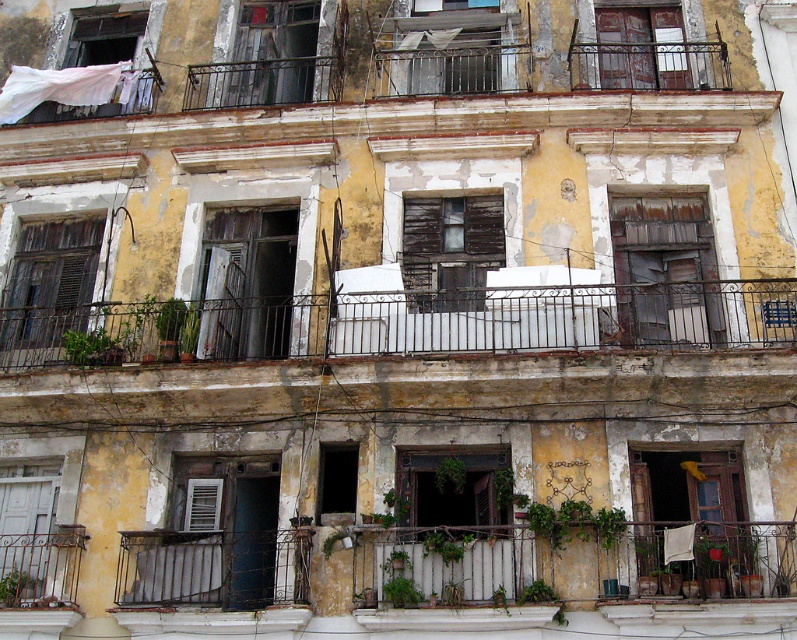
Question: Which object is closer to the camera taking this photo?

Choices:
 (A) wooden door at lower left
 (B) matte white cloth at upper left
 (C) wooden shuttered window at left

Answer: (A)

Question: Can you confirm if wooden shuttered window at left is positioned to the left of matte glass window at upper center?

Choices:
 (A) yes
 (B) no

Answer: (A)

Question: Which point is closer to the camera?

Choices:
 (A) (658, 323)
 (B) (448, 288)
 (C) (240, 228)
 (D) (664, 56)

Answer: (A)

Question: Which object is farther from the camera taking this photo?

Choices:
 (A) rusty metal balcony at center
 (B) wooden shuttered window at center
 (C) metallic gray curtain at lower center

Answer: (A)

Question: Is the position of wooden shuttered window at left less distant than that of wooden door at lower left?

Choices:
 (A) yes
 (B) no

Answer: (B)

Question: Does wooden door at center appear on the left side of wooden door at lower left?

Choices:
 (A) yes
 (B) no

Answer: (B)